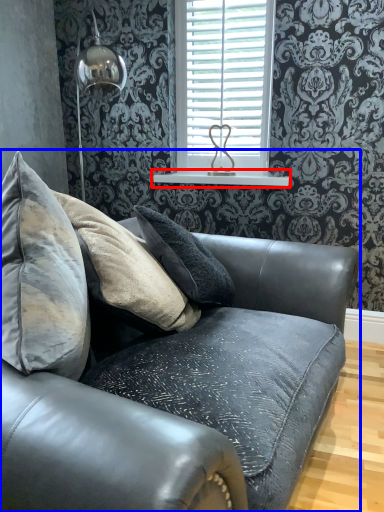
Question: Which object is further to the camera taking this photo, window sill (highlighted by a red box) or studio couch (highlighted by a blue box)?

Choices:
 (A) window sill
 (B) studio couch

Answer: (A)